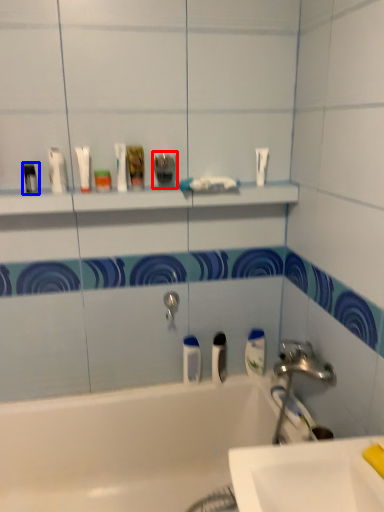
Question: Which point is closer to the camera, toiletry (highlighted by a red box) or toiletry (highlighted by a blue box)?

Choices:
 (A) toiletry
 (B) toiletry

Answer: (B)